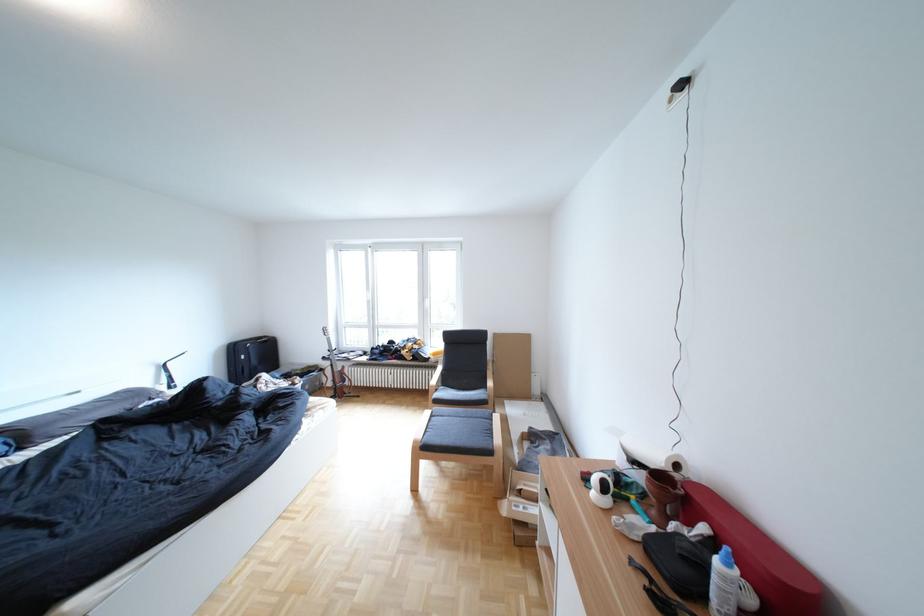
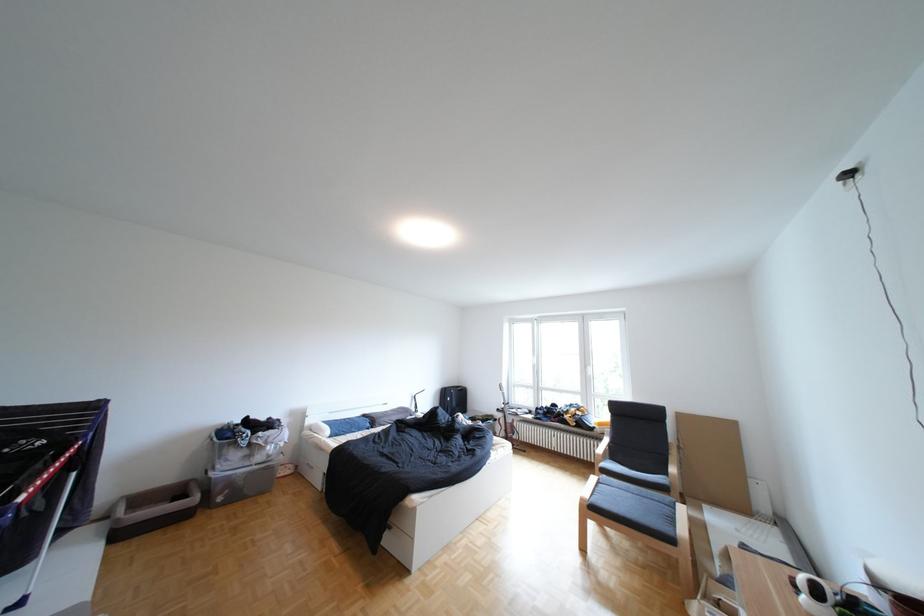
Where in the second image is the point corresponding to the point at 322,371 from the first image?

(502, 419)